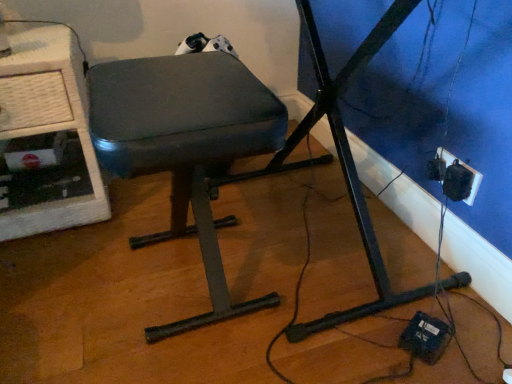
Question: Relative to white textured computer desk at left, is matte black stool at center in front or behind?

Choices:
 (A) front
 (B) behind

Answer: (A)

Question: Is point (179, 152) closer or farther from the camera than point (25, 64)?

Choices:
 (A) farther
 (B) closer

Answer: (B)

Question: Based on their relative distances, which object is nearer to the white textured computer desk at left?

Choices:
 (A) black plastic socket at lower right
 (B) matte black stool at center

Answer: (B)

Question: Which is nearer to the matte black stool at center?

Choices:
 (A) black plastic socket at lower right
 (B) white textured computer desk at left

Answer: (B)